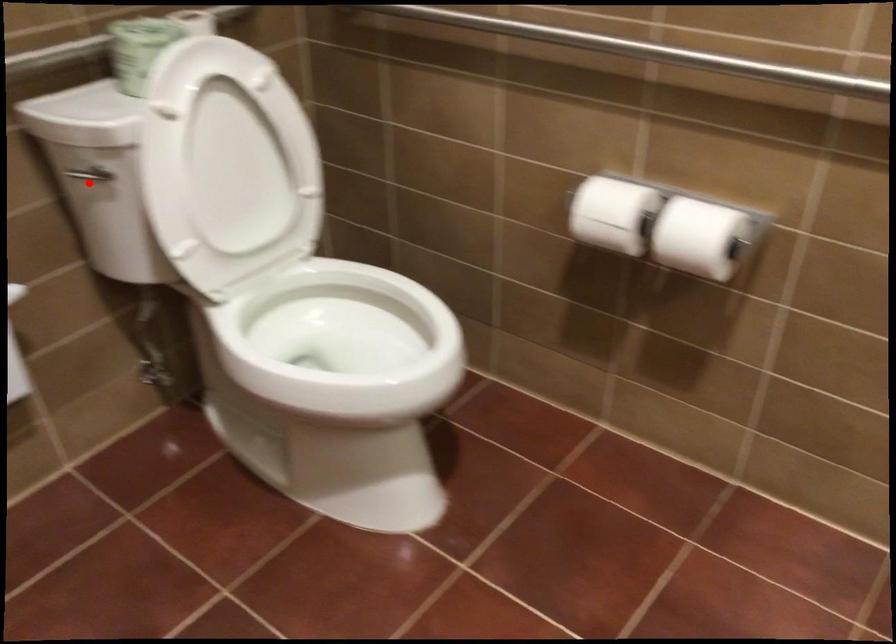
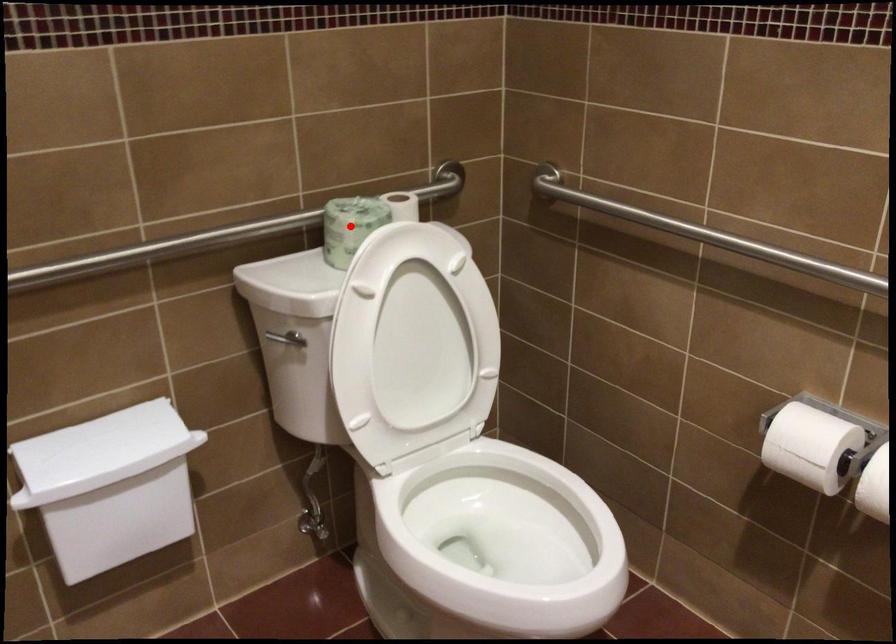
I am providing you with two images of the same scene from different viewpoints. A red point is marked on the first image and another point is marked on the second image. Do the highlighted points in image1 and image2 indicate the same real-world spot?

No